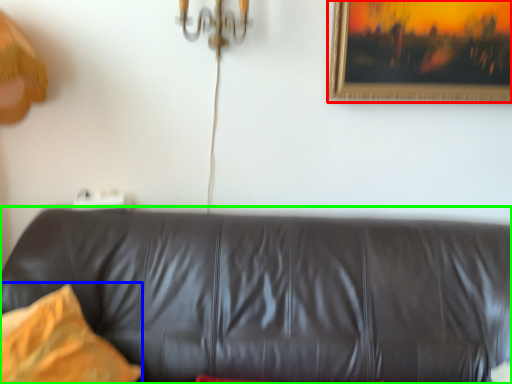
Question: Which object is positioned closest to picture frame (highlighted by a red box)? Select from pillow (highlighted by a blue box) and studio couch (highlighted by a green box).

Choices:
 (A) pillow
 (B) studio couch

Answer: (B)